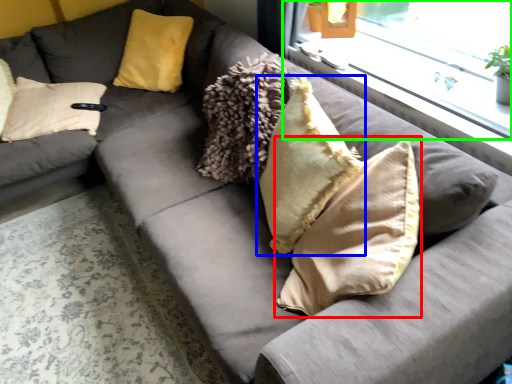
Question: Which object is positioned farthest from pillow (highlighted by a red box)? Select from pillow (highlighted by a blue box) and window (highlighted by a green box).

Choices:
 (A) pillow
 (B) window

Answer: (B)